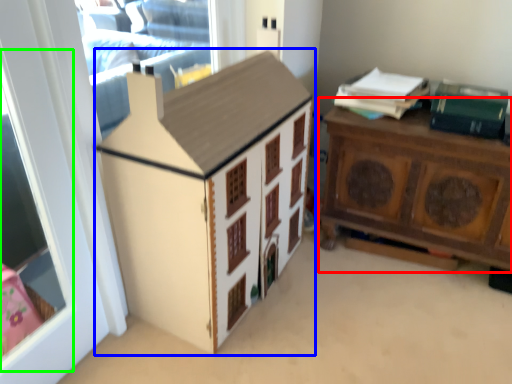
Question: Which object is the farthest from nightstand (highlighted by a red box)? Choose among these: cabinetry (highlighted by a blue box) or window screen (highlighted by a green box).

Choices:
 (A) cabinetry
 (B) window screen

Answer: (B)